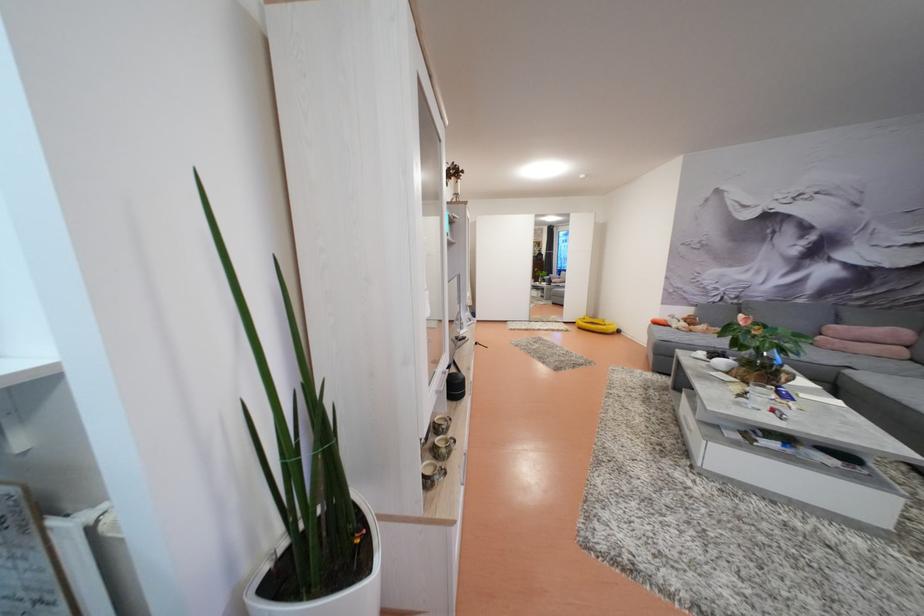
You are a GUI agent. You are given a task and a screenshot of the screen. Output one action in this format:
    pyautogui.click(x=<x>, y=<y>)
    Task: Click on the white sliding door
    
    Given the screenshot: What is the action you would take?
    pyautogui.click(x=503, y=265)